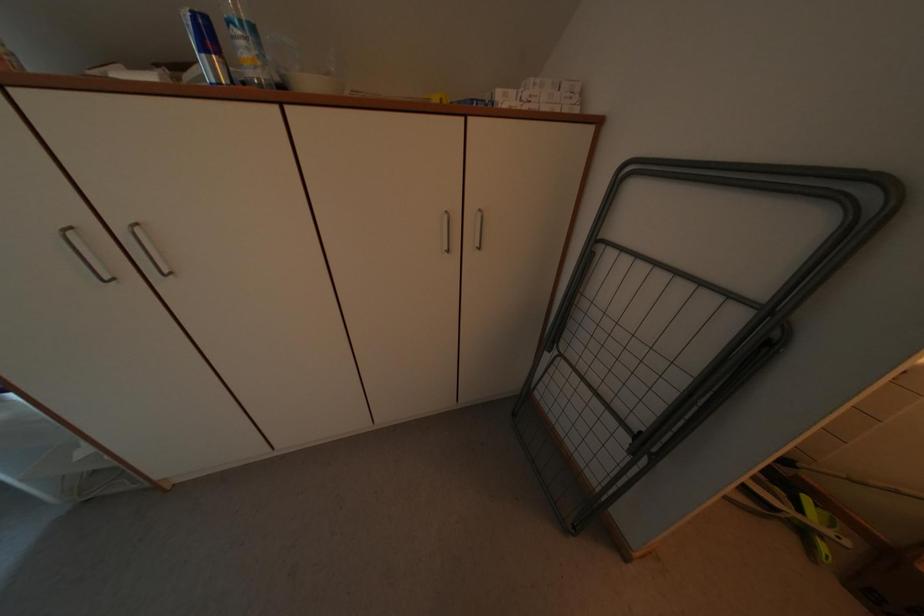
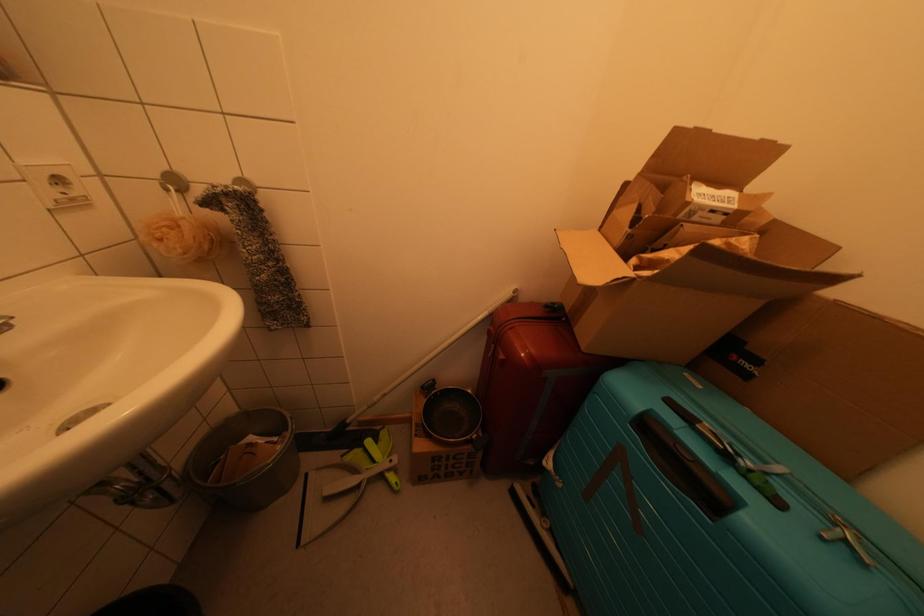
The first image is from the beginning of the video and the second image is from the end. How did the camera likely rotate when shooting the video?

The camera's rotation is toward right-down.